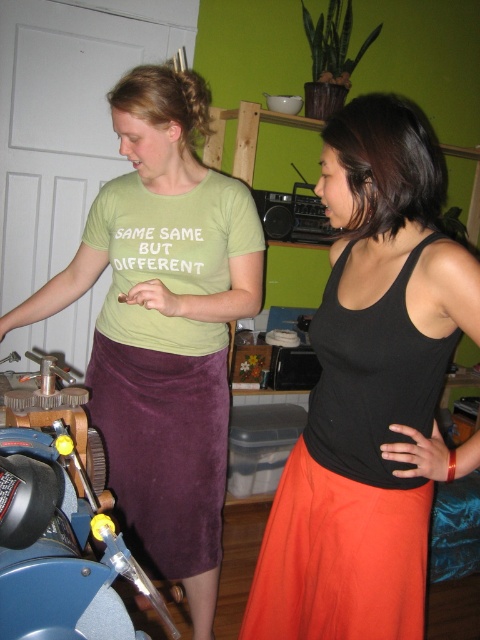
You are organizing a fashion show and need to arrange the velvet purple skirt at center and the brushed metal motorcycle at lower left on the runway. According to the scene, which item should be placed to the right side of the runway?

The brushed metal motorcycle at lower left should be placed to the right side of the runway because in the scene, the velvet purple skirt at center is to the left of it.

You are a delivery person who needs to place a small package between the black matte tank top at center and the brushed metal motorcycle at lower left. The package is 50 centimeters long. Can you fit it between them without moving either object?

The black matte tank top at center is 48.16 centimeters away from the brushed metal motorcycle at lower left. Since the package is 50 centimeters long, which is slightly longer than the distance between them, it won